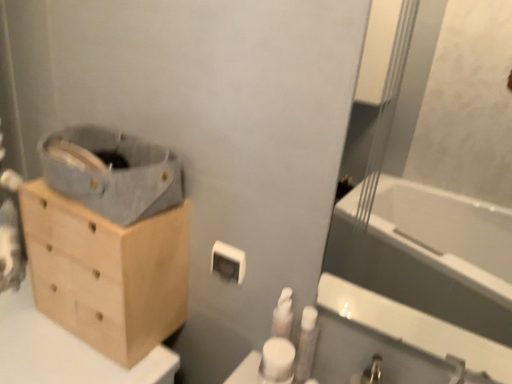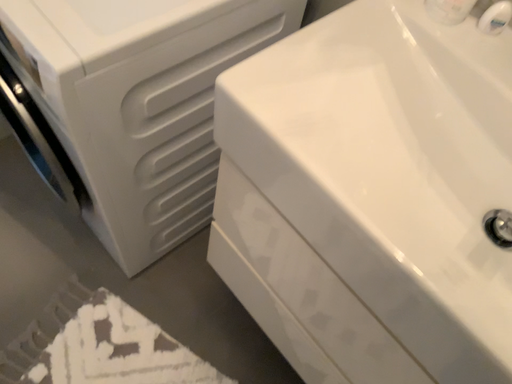
Question: Which way did the camera rotate in the video?

Choices:
 (A) rotated downward
 (B) rotated upward

Answer: (A)